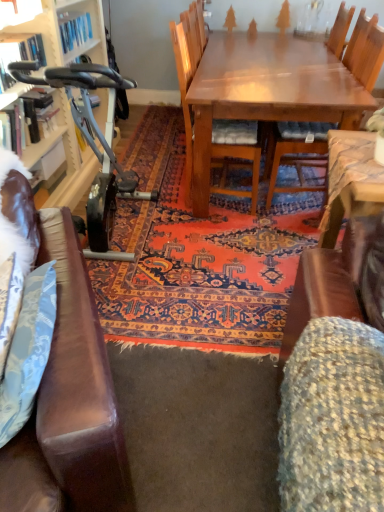
Question: Is metallic blue exercise bike at left a part of fluffy fabric swivel chair at lower right?

Choices:
 (A) no
 (B) yes

Answer: (A)

Question: Is fluffy fabric swivel chair at lower right beside metallic blue exercise bike at left?

Choices:
 (A) yes
 (B) no

Answer: (B)

Question: Is fluffy fabric swivel chair at lower right further to camera compared to metallic blue exercise bike at left?

Choices:
 (A) no
 (B) yes

Answer: (A)

Question: Considering the relative positions of fluffy fabric swivel chair at lower right and metallic blue exercise bike at left in the image provided, is fluffy fabric swivel chair at lower right to the right of metallic blue exercise bike at left from the viewer's perspective?

Choices:
 (A) no
 (B) yes

Answer: (B)

Question: Is fluffy fabric swivel chair at lower right positioned beyond the bounds of metallic blue exercise bike at left?

Choices:
 (A) no
 (B) yes

Answer: (B)

Question: In terms of width, does fluffy fabric swivel chair at lower right look wider or thinner when compared to wooden chair at center, which is counted as the first chair, starting from the left?

Choices:
 (A) thin
 (B) wide

Answer: (A)

Question: Is fluffy fabric swivel chair at lower right spatially inside wooden chair at center, which is counted as the first chair, starting from the left, or outside of it?

Choices:
 (A) inside
 (B) outside

Answer: (B)

Question: From a real-world perspective, is fluffy fabric swivel chair at lower right positioned above or below wooden chair at center, which is the second chair from right to left?

Choices:
 (A) below
 (B) above

Answer: (A)

Question: Considering the positions of fluffy fabric swivel chair at lower right and wooden chair at center, which is the second chair from right to left, in the image, is fluffy fabric swivel chair at lower right taller or shorter than wooden chair at center, which is the second chair from right to left,?

Choices:
 (A) short
 (B) tall

Answer: (A)

Question: From a real-world perspective, is fluffy fabric swivel chair at lower right positioned above or below wooden chair at center, positioned as the 2th chair in left-to-right order?

Choices:
 (A) above
 (B) below

Answer: (B)

Question: Based on their positions, is fluffy fabric swivel chair at lower right located to the left or right of wooden chair at center, which is counted as the 1th chair, starting from the right?

Choices:
 (A) right
 (B) left

Answer: (B)

Question: In terms of height, does fluffy fabric swivel chair at lower right look taller or shorter compared to wooden chair at center, positioned as the 2th chair in left-to-right order?

Choices:
 (A) tall
 (B) short

Answer: (B)

Question: In terms of width, does fluffy fabric swivel chair at lower right look wider or thinner when compared to wooden chair at center, positioned as the 2th chair in left-to-right order?

Choices:
 (A) thin
 (B) wide

Answer: (A)

Question: Is wooden bookcase at left inside the boundaries of metallic blue exercise bike at left, or outside?

Choices:
 (A) inside
 (B) outside

Answer: (B)

Question: From the image's perspective, relative to metallic blue exercise bike at left, is wooden bookcase at left above or below?

Choices:
 (A) above
 (B) below

Answer: (B)